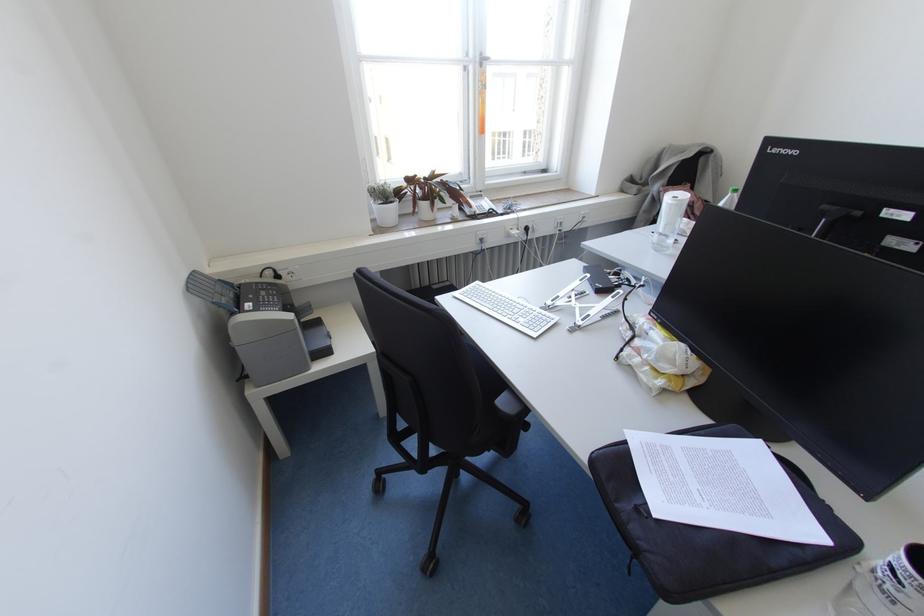
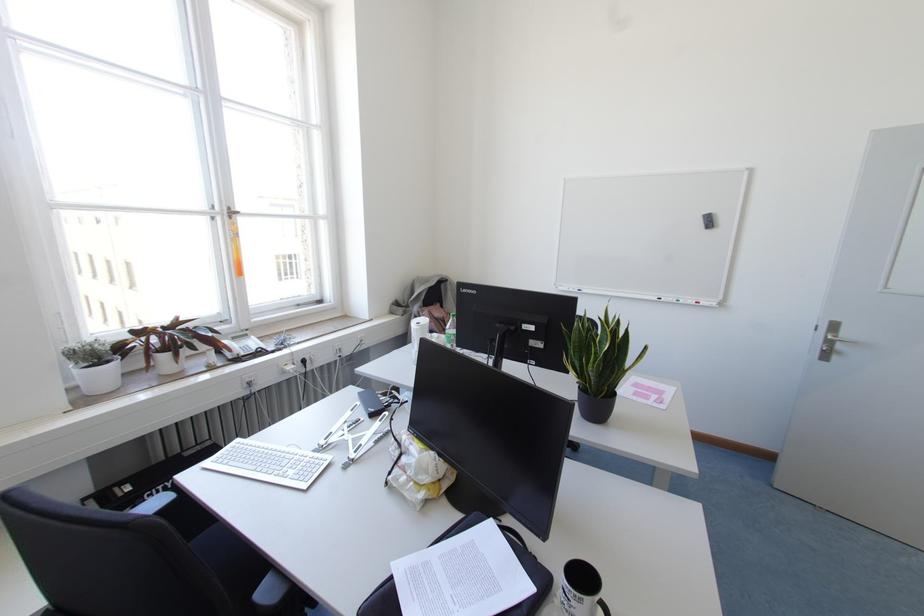
Question: The camera is either moving clockwise (left) or counter-clockwise (right) around the object. The first image is from the beginning of the video and the second image is from the end. Is the camera moving left or right when shooting the video?

Choices:
 (A) Left
 (B) Right

Answer: (A)